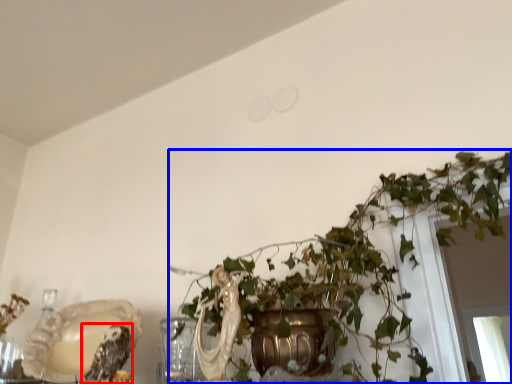
Question: Which of the following is the closest to the observer, owl (highlighted by a red box) or houseplant (highlighted by a blue box)?

Choices:
 (A) owl
 (B) houseplant

Answer: (B)